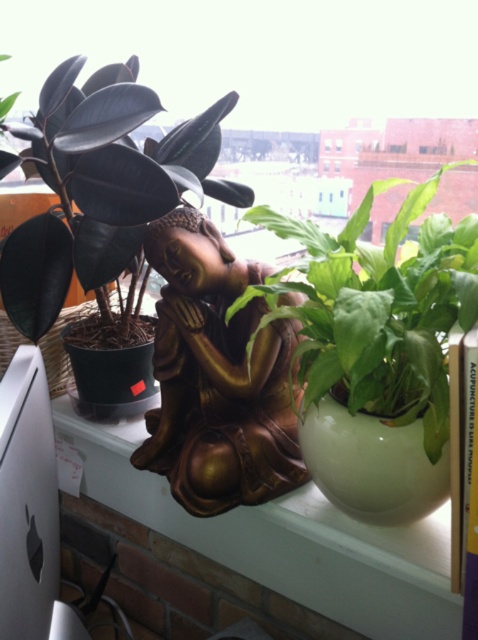
Does rubberleather-likeplant at center appear on the left side of gold polished statue at center?

Indeed, rubberleather-likeplant at center is positioned on the left side of gold polished statue at center.

At what (x,y) coordinates should I click in order to perform the action: click on rubberleather-likeplant at center. Please return your answer as a coordinate pair (x, y). Looking at the image, I should click on (104, 193).

At what (x,y) coordinates should I click in order to perform the action: click on rubberleather-likeplant at center. Please return your answer as a coordinate pair (x, y). The height and width of the screenshot is (640, 478). Looking at the image, I should click on (104, 193).

Can you confirm if gold polished statue at center is wider than green glossy leafy plant at center?

No.

Does gold polished statue at center appear over green glossy leafy plant at center?

Actually, gold polished statue at center is below green glossy leafy plant at center.

Between point (169, 464) and point (365, 218), which one is positioned in front?

Point (365, 218)

Locate an element on the screen. gold polished statue at center is located at coordinates (217, 376).

Does rubberleather-likeplant at center have a lesser height compared to green glossy leafy plant at center?

No.

Who is taller, rubberleather-likeplant at center or green glossy leafy plant at center?

rubberleather-likeplant at center

Locate an element on the screen. rubberleather-likeplant at center is located at coordinates (104, 193).

Where is `rubberleather-likeplant at center`? This screenshot has height=640, width=478. rubberleather-likeplant at center is located at coordinates (104, 193).